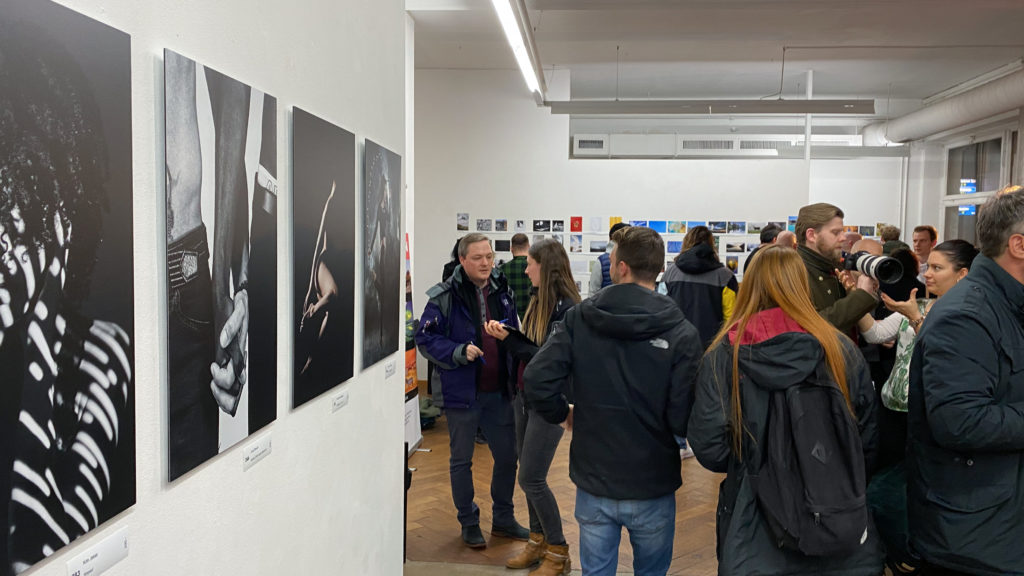
You are a GUI agent. You are given a task and a screenshot of the screen. Output one action in this format:
    pyautogui.click(x=<x>, y=<y>)
    Task: Click on the ceiling light
    This screenshot has width=1024, height=576.
    Given the screenshot: What is the action you would take?
    pyautogui.click(x=504, y=6), pyautogui.click(x=520, y=54)